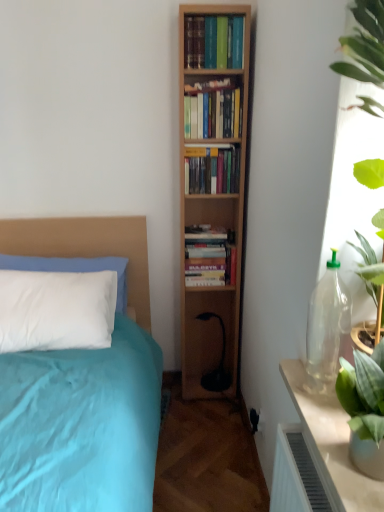
Locate an element on the screen. The width and height of the screenshot is (384, 512). empty space that is ontop of hardcover books at center, which ranks as the fourth book in top-to-bottom order is located at coordinates (208, 230).